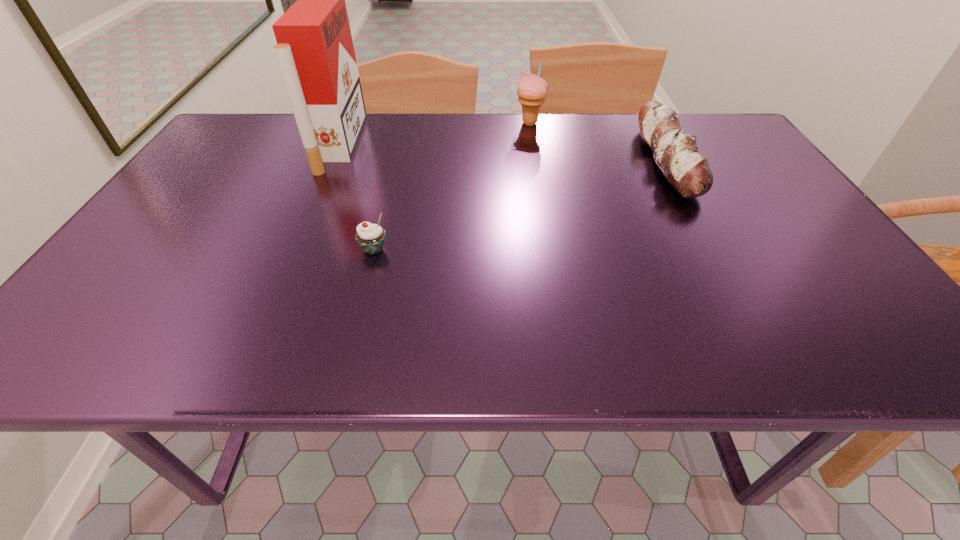
Locate an element on the screen. cigarette case is located at coordinates (315, 52).

This screenshot has height=540, width=960. Identify the location of the tallest object. (315, 52).

This screenshot has width=960, height=540. I want to click on the third shortest object, so click(x=531, y=89).

Where is `the third object from left to right`? The width and height of the screenshot is (960, 540). the third object from left to right is located at coordinates (531, 89).

The image size is (960, 540). I want to click on baguet, so click(676, 153).

Locate an element on the screen. This screenshot has width=960, height=540. the nearest object is located at coordinates (370, 237).

This screenshot has height=540, width=960. I want to click on the second object from left to right, so click(x=370, y=237).

What are the coordinates of `vacant space located on the front-facing side of the tallest object` in the screenshot? It's located at [x=492, y=144].

Identify the location of free space located 0.110m on the right of the third object from left to right. (582, 123).

Where is `vacant point located 0.280m on the left of the baguet`? vacant point located 0.280m on the left of the baguet is located at coordinates (538, 161).